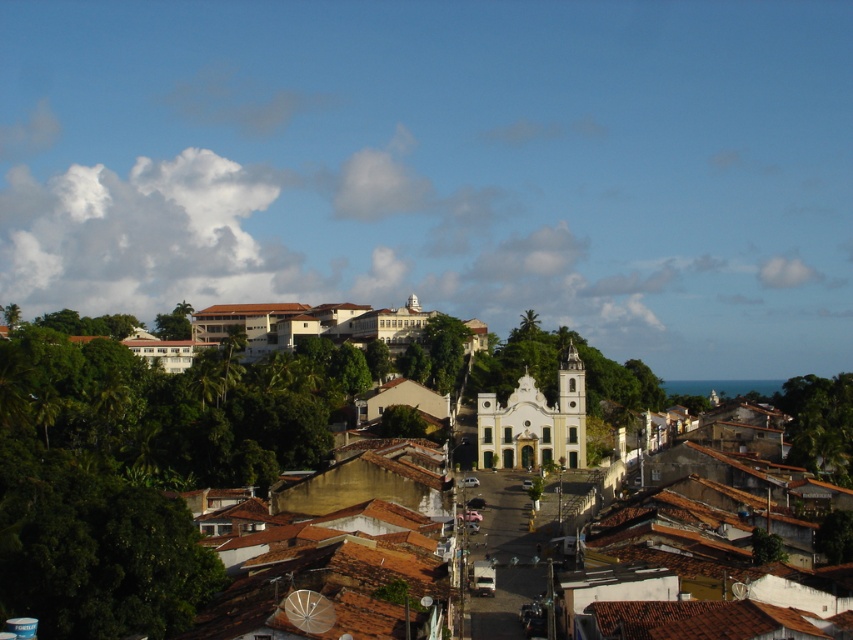
You are a tourist standing at the edge of the village looking towards the center. You see the white stucco church at center and the green leafy tree at center. Which object appears bigger to you?

The white stucco church at center appears bigger than the green leafy tree at center because it is larger in size according to the description.

You are standing in the village square and want to take a photo of the white stucco church at center and the green leafy tree at lower right. Which object will appear larger in the photo?

The white stucco church at center will appear larger in the photo because it is closer to the viewer than the green leafy tree at lower right.

You are standing at the entrance of the village and want to take a photo of the white stucco church at center and the green leafy tree at center. Which object should you focus on first to ensure both are in frame?

The white stucco church at center is positioned over the green leafy tree at center, so you should focus on the church first as it is closer to your view and will ensure both are in frame.